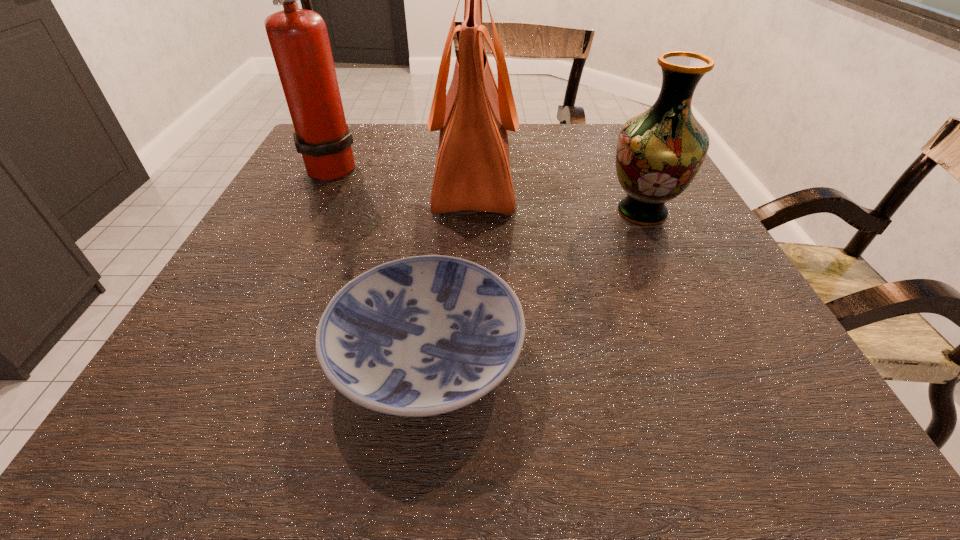
The height and width of the screenshot is (540, 960). What are the coordinates of `vacant space that satisfies the following two spatial constraints: 1. at the nozzle of the rightmost object; 2. on the right side of the tallest object` in the screenshot? It's located at (310, 212).

Locate an element on the screen. Image resolution: width=960 pixels, height=540 pixels. free space that satisfies the following two spatial constraints: 1. on the back side of the vase; 2. at the nozzle of the tallest object is located at coordinates (620, 165).

Locate an element on the screen. vacant region that satisfies the following two spatial constraints: 1. on the front pocket of the shopping bag; 2. on the back side of the vase is located at coordinates (473, 212).

Find the location of a particular element. Image resolution: width=960 pixels, height=540 pixels. free space that satisfies the following two spatial constraints: 1. at the nozzle of the nearest object; 2. on the left side of the fire extinguisher is located at coordinates (241, 353).